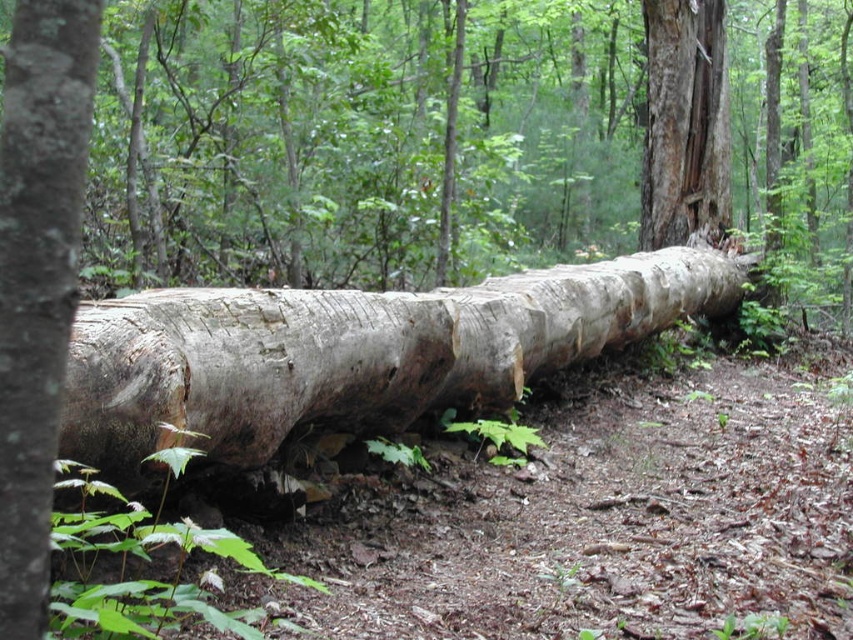
Question: Is smooth bark log at center below gray rough bark tree trunk at center?

Choices:
 (A) no
 (B) yes

Answer: (B)

Question: Which is farther from the smooth bark log at center?

Choices:
 (A) gray rough bark tree trunk at center
 (B) natural wood log at center

Answer: (A)

Question: Does smooth bark log at center appear under gray rough bark tree trunk at center?

Choices:
 (A) no
 (B) yes

Answer: (B)

Question: Does smooth bark log at center have a larger size compared to gray rough bark tree trunk at center?

Choices:
 (A) no
 (B) yes

Answer: (A)

Question: Which is farther from the gray rough bark tree trunk at center?

Choices:
 (A) natural wood log at center
 (B) smooth bark log at center

Answer: (B)

Question: Which point is farther from the camera taking this photo?

Choices:
 (A) (27, 403)
 (B) (664, 106)

Answer: (B)